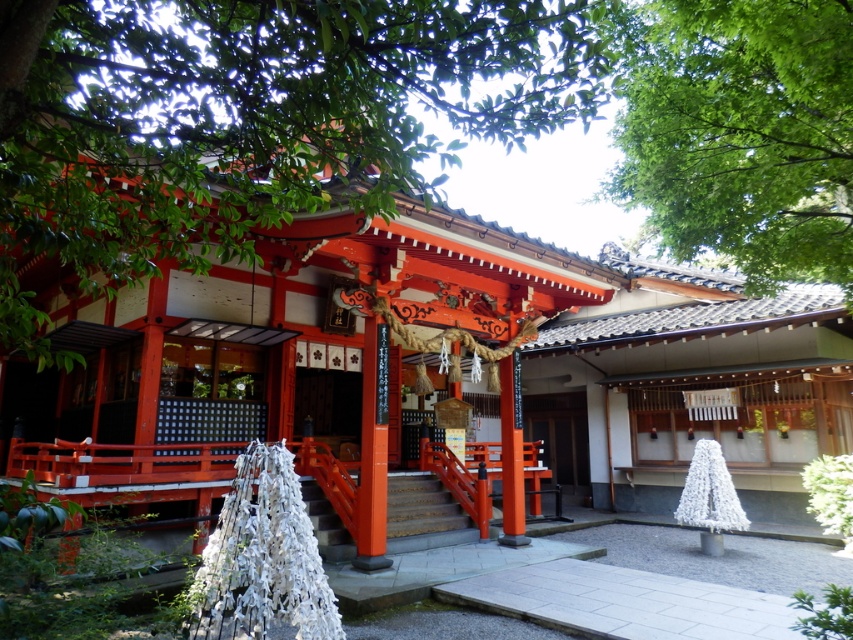
Is smooth wood stairs at center further to camera compared to smooth wooden door at center?

No, it is not.

Who is higher up, smooth wood stairs at center or smooth wooden door at center?

smooth wood stairs at center

Locate an element on the screen. This screenshot has width=853, height=640. smooth wood stairs at center is located at coordinates (422, 513).

Does green leafy tree at upper left have a greater height compared to smooth wood stairs at center?

Yes, green leafy tree at upper left is taller than smooth wood stairs at center.

What do you see at coordinates (250, 120) in the screenshot? Image resolution: width=853 pixels, height=640 pixels. I see `green leafy tree at upper left` at bounding box center [250, 120].

At what (x,y) coordinates should I click in order to perform the action: click on green leafy tree at upper left. Please return your answer as a coordinate pair (x, y). Looking at the image, I should click on (250, 120).

Does green leafy tree at upper right have a lesser height compared to smooth wood stairs at center?

In fact, green leafy tree at upper right may be taller than smooth wood stairs at center.

Between green leafy tree at upper right and smooth wood stairs at center, which one appears on the left side from the viewer's perspective?

smooth wood stairs at center

Locate an element on the screen. This screenshot has height=640, width=853. green leafy tree at upper right is located at coordinates (740, 132).